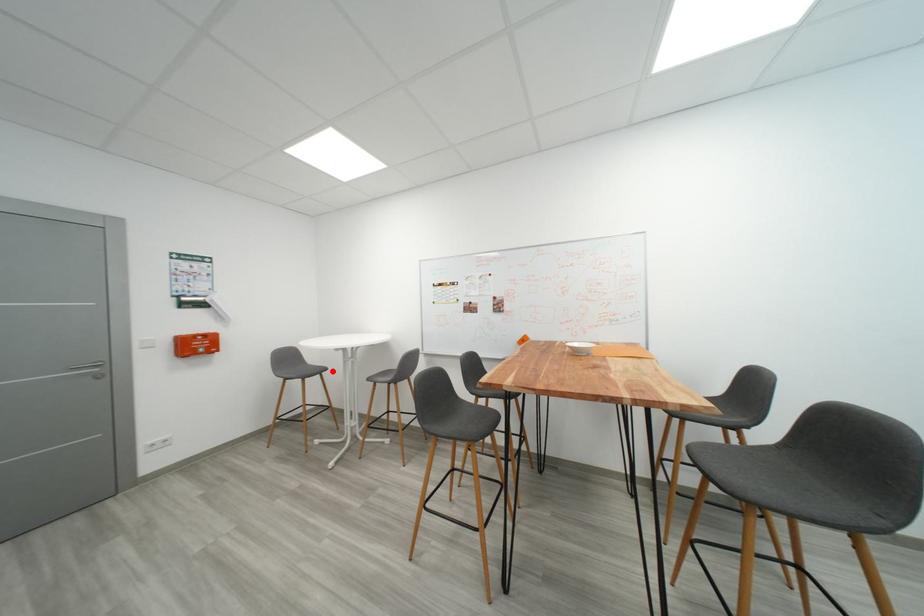
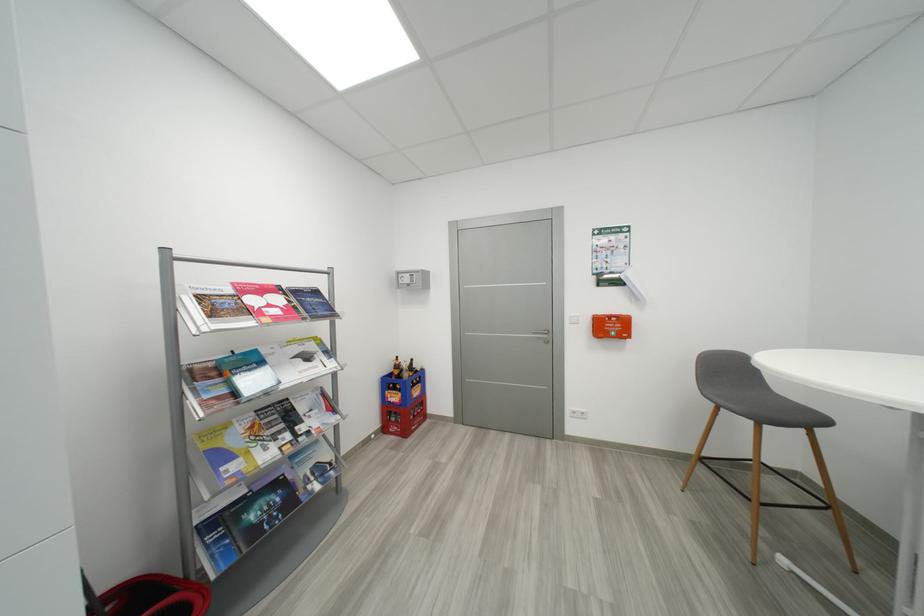
In the second image, find the point that corresponds to the highlighted location in the first image.

(833, 424)